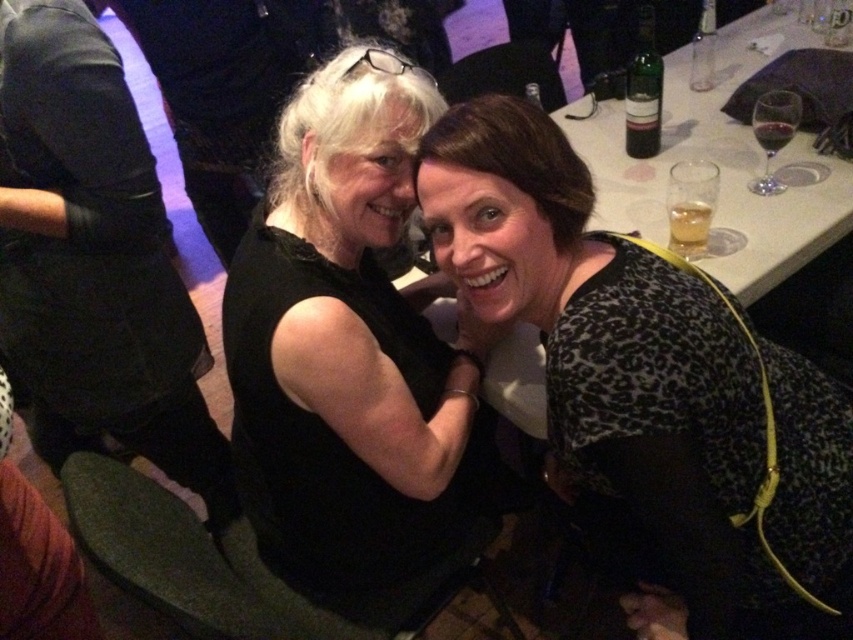
In the scene shown: Can you confirm if black leopard print dress at center is thinner than black matte dress at center?

No.

Can you confirm if black leopard print dress at center is taller than black matte dress at center?

No.

Where is `black leopard print dress at center`? The image size is (853, 640). black leopard print dress at center is located at coordinates (650, 388).

Can you confirm if black matte dress at center is bigger than translucent plastic cup at upper right?

Yes, black matte dress at center is bigger than translucent plastic cup at upper right.

Which is below, black matte dress at center or translucent plastic cup at upper right?

black matte dress at center is below.

The height and width of the screenshot is (640, 853). In order to click on black matte dress at center in this screenshot , I will do `click(352, 355)`.

Is black matte dress at center below translucent glass at upper right?

Yes, black matte dress at center is below translucent glass at upper right.

Is black matte dress at center above translucent glass at upper right?

No.

Which is in front, point (397, 611) or point (706, 221)?

Point (397, 611) is more forward.

Find the location of a particular element. The width and height of the screenshot is (853, 640). black matte dress at center is located at coordinates 352,355.